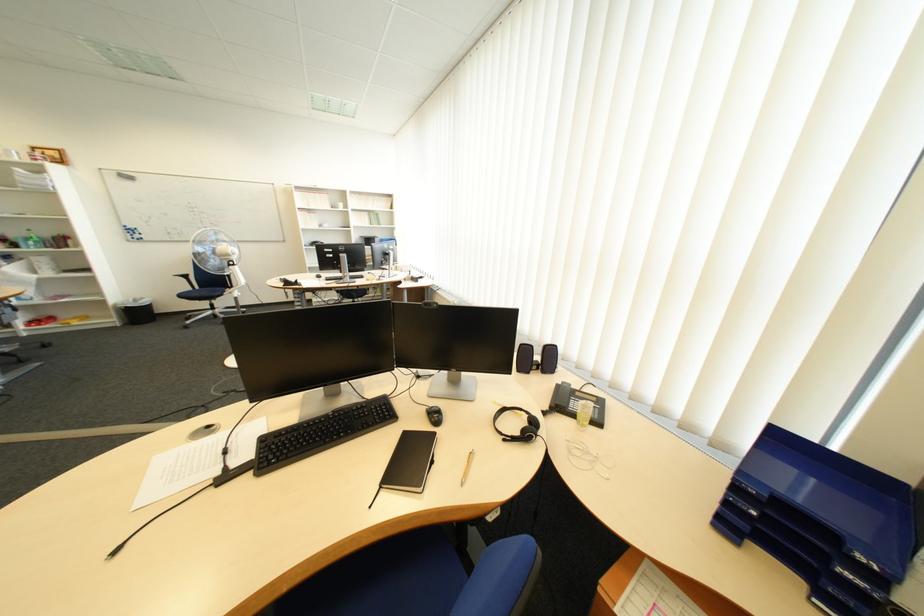
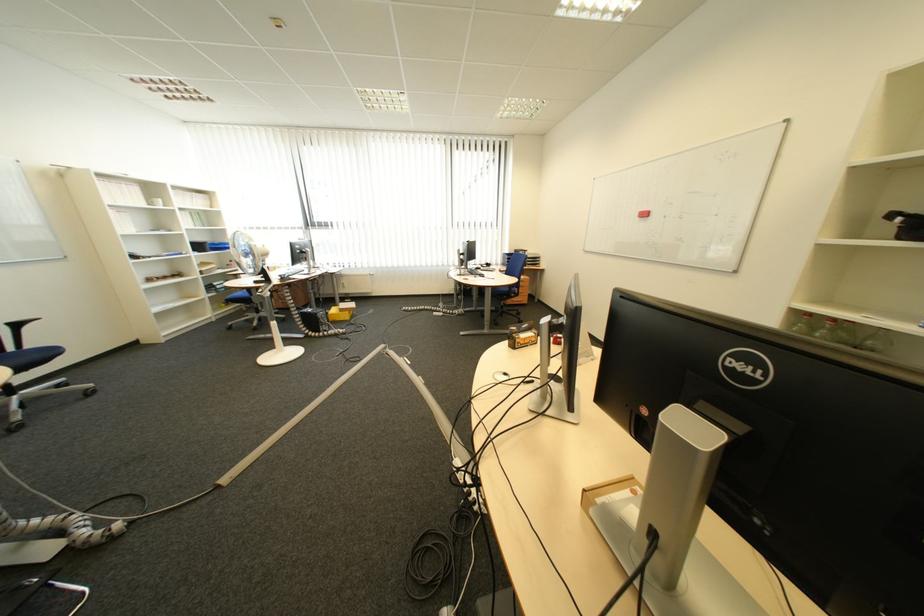
Question: I am providing you with two images of the same scene from different viewpoints. Please identify which objects are invisible in image2.

Choices:
 (A) red board eraser
 (B) white mug
 (C) black computer speaker
 (D) white cloth bag

Answer: (C)